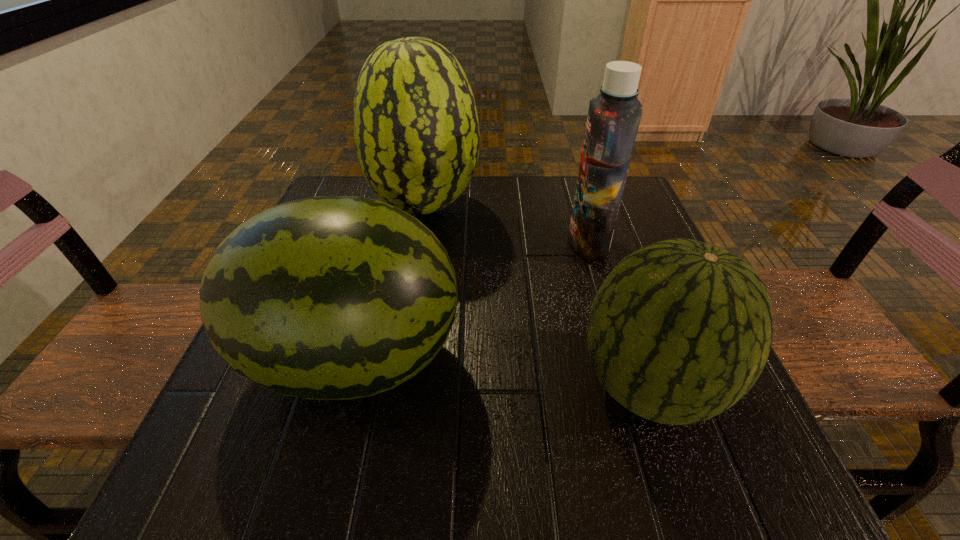
Where is `the tallest watermelon`? Image resolution: width=960 pixels, height=540 pixels. the tallest watermelon is located at coordinates (416, 130).

The image size is (960, 540). I want to click on shampoo, so click(x=613, y=120).

Where is `the rightmost watermelon`? The height and width of the screenshot is (540, 960). the rightmost watermelon is located at coordinates (680, 330).

Identify the location of free spot located 0.130m on the right of the farthest watermelon. (536, 206).

The width and height of the screenshot is (960, 540). What are the coordinates of `free location located 0.370m on the front label of the shampoo` in the screenshot? It's located at (392, 241).

Where is `blank space located 0.110m on the front label of the shampoo`? The width and height of the screenshot is (960, 540). blank space located 0.110m on the front label of the shampoo is located at coordinates (516, 241).

The height and width of the screenshot is (540, 960). Find the location of `vacant space situated on the front label of the shampoo`. vacant space situated on the front label of the shampoo is located at coordinates (411, 241).

Find the location of a particular element. The image size is (960, 540). vacant space located 0.330m on the back of the rightmost watermelon is located at coordinates click(593, 219).

Locate an element on the screen. This screenshot has width=960, height=540. watermelon that is at the far edge is located at coordinates (416, 130).

The height and width of the screenshot is (540, 960). In order to click on shampoo that is at the far edge in this screenshot , I will do click(613, 120).